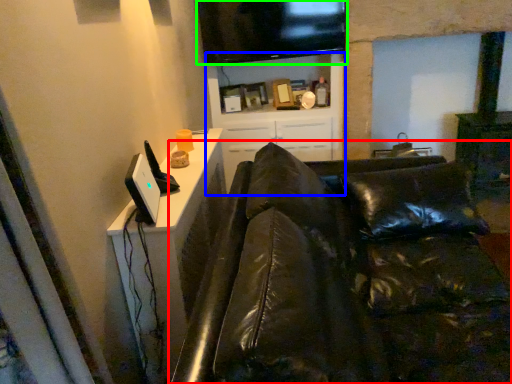
Question: Which object is the farthest from studio couch (highlighted by a red box)? Choose among these: entertainment center (highlighted by a blue box) or television (highlighted by a green box).

Choices:
 (A) entertainment center
 (B) television

Answer: (B)